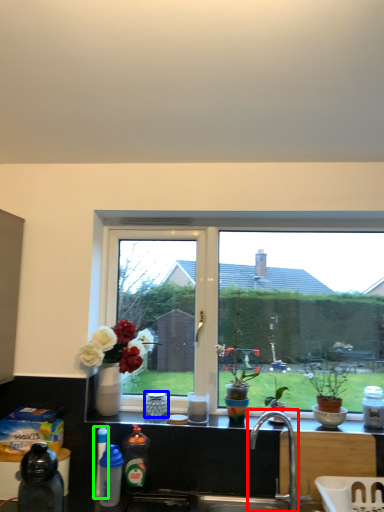
Question: Which object is the closest to the tap (highlighted by a red box)? Choose among these: coffee cup (highlighted by a blue box) or bottle (highlighted by a green box).

Choices:
 (A) coffee cup
 (B) bottle

Answer: (A)